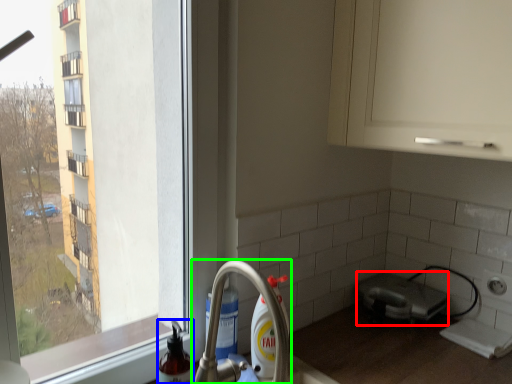
Question: Which object is positioned farthest from appliance (highlighted by a red box)? Select from cleaning product (highlighted by a blue box) and tap (highlighted by a green box).

Choices:
 (A) cleaning product
 (B) tap

Answer: (A)